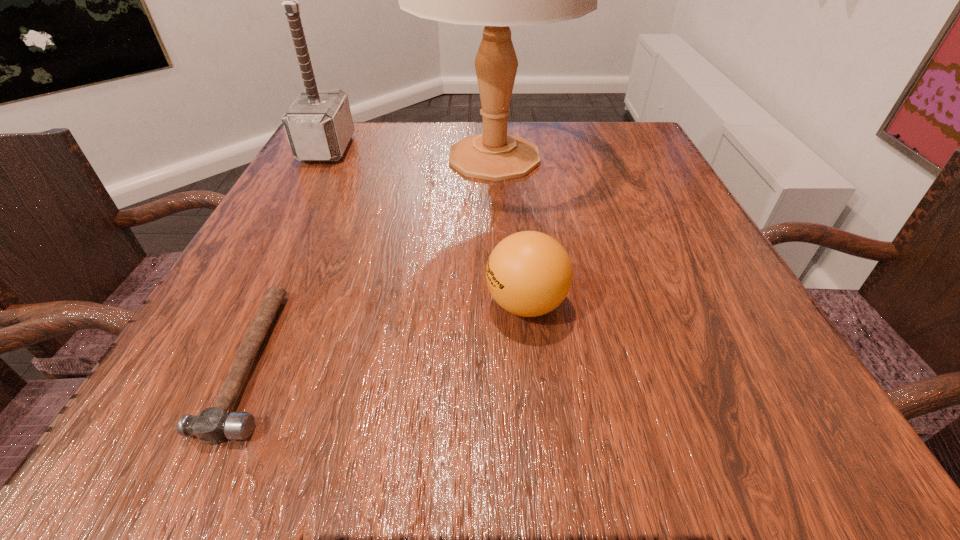
Identify the location of vacant area that lies between the ping-pong ball and the shorter hammer. The height and width of the screenshot is (540, 960). (389, 332).

This screenshot has width=960, height=540. Find the location of `empty space between the ping-pong ball and the shortest object`. empty space between the ping-pong ball and the shortest object is located at coordinates (389, 332).

The width and height of the screenshot is (960, 540). What are the coordinates of `unoccupied area between the third tallest object and the third shortest object` in the screenshot? It's located at (426, 226).

At what (x,y) coordinates should I click in order to perform the action: click on vacant region between the second shortest object and the tallest object. Please return your answer as a coordinate pair (x, y). Looking at the image, I should click on (510, 231).

Where is `object that is the second closest to the nearer hammer`? object that is the second closest to the nearer hammer is located at coordinates (496, 0).

Locate which object ranks third in proximity to the table lamp. Please provide its 2D coordinates. Your answer should be formatted as a tuple, i.e. [(x, y)], where the tuple contains the x and y coordinates of a point satisfying the conditions above.

[(212, 425)]

The height and width of the screenshot is (540, 960). Identify the location of free location that satisfies the following two spatial constraints: 1. for striking with the head of the taller hammer; 2. on the back side of the table lamp. (322, 158).

The width and height of the screenshot is (960, 540). I want to click on free space that satisfies the following two spatial constraints: 1. for striking with the head of the taller hammer; 2. on the left side of the tallest object, so click(322, 158).

The height and width of the screenshot is (540, 960). I want to click on blank space that satisfies the following two spatial constraints: 1. for striking with the head of the taller hammer; 2. on the back side of the tallest object, so click(322, 158).